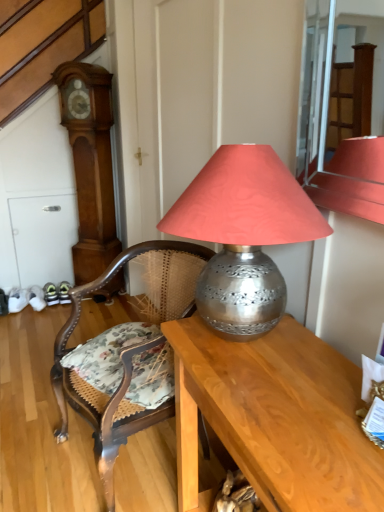
Question: From a real-world perspective, is metallic silver lamp at center below wooden cane chair at center?

Choices:
 (A) no
 (B) yes

Answer: (A)

Question: Does metallic silver lamp at center contain wooden cane chair at center?

Choices:
 (A) yes
 (B) no

Answer: (B)

Question: Can you confirm if metallic silver lamp at center is bigger than wooden cane chair at center?

Choices:
 (A) no
 (B) yes

Answer: (A)

Question: From the image's perspective, is metallic silver lamp at center under wooden cane chair at center?

Choices:
 (A) yes
 (B) no

Answer: (B)

Question: Is metallic silver lamp at center facing away from wooden cane chair at center?

Choices:
 (A) yes
 (B) no

Answer: (B)

Question: Is metallic silver lamp at center to the left of wooden cane chair at center from the viewer's perspective?

Choices:
 (A) no
 (B) yes

Answer: (A)

Question: From a real-world perspective, is wooden cane chair at center positioned over wooden desk at center based on gravity?

Choices:
 (A) no
 (B) yes

Answer: (B)

Question: Can you confirm if wooden cane chair at center is shorter than wooden desk at center?

Choices:
 (A) yes
 (B) no

Answer: (B)

Question: Could you tell me if wooden cane chair at center is facing wooden desk at center?

Choices:
 (A) yes
 (B) no

Answer: (B)

Question: From a real-world perspective, is wooden cane chair at center physically below wooden desk at center?

Choices:
 (A) yes
 (B) no

Answer: (B)

Question: Is wooden cane chair at center smaller than wooden desk at center?

Choices:
 (A) no
 (B) yes

Answer: (A)

Question: Can you confirm if wooden cane chair at center is taller than wooden desk at center?

Choices:
 (A) yes
 (B) no

Answer: (A)

Question: Can you confirm if metallic silver lamp at center is shorter than wooden grandfather clock at left?

Choices:
 (A) no
 (B) yes

Answer: (B)